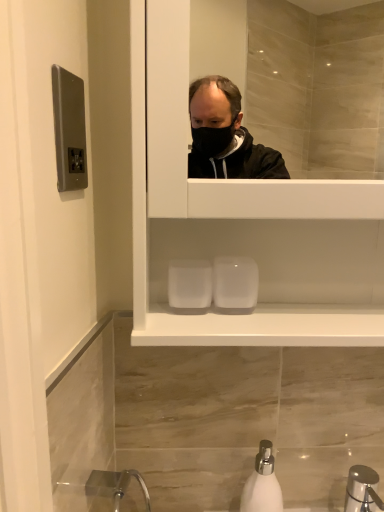
Question: Looking at the image, does satin nickel switchplate at upper left seem bigger or smaller compared to white matte soap dispenser at lower center?

Choices:
 (A) small
 (B) big

Answer: (A)

Question: Is satin nickel switchplate at upper left wider or thinner than white matte soap dispenser at lower center?

Choices:
 (A) thin
 (B) wide

Answer: (A)

Question: From the image's perspective, relative to white matte soap dispenser at lower center, is satin nickel switchplate at upper left above or below?

Choices:
 (A) above
 (B) below

Answer: (A)

Question: From a real-world perspective, is white matte soap dispenser at lower center above or below satin nickel switchplate at upper left?

Choices:
 (A) below
 (B) above

Answer: (A)

Question: Looking at the image, does white matte soap dispenser at lower center seem bigger or smaller compared to satin nickel switchplate at upper left?

Choices:
 (A) small
 (B) big

Answer: (B)

Question: From their relative heights in the image, would you say white matte soap dispenser at lower center is taller or shorter than satin nickel switchplate at upper left?

Choices:
 (A) tall
 (B) short

Answer: (A)

Question: Would you say white matte soap dispenser at lower center is to the left or to the right of satin nickel switchplate at upper left in the picture?

Choices:
 (A) left
 (B) right

Answer: (B)